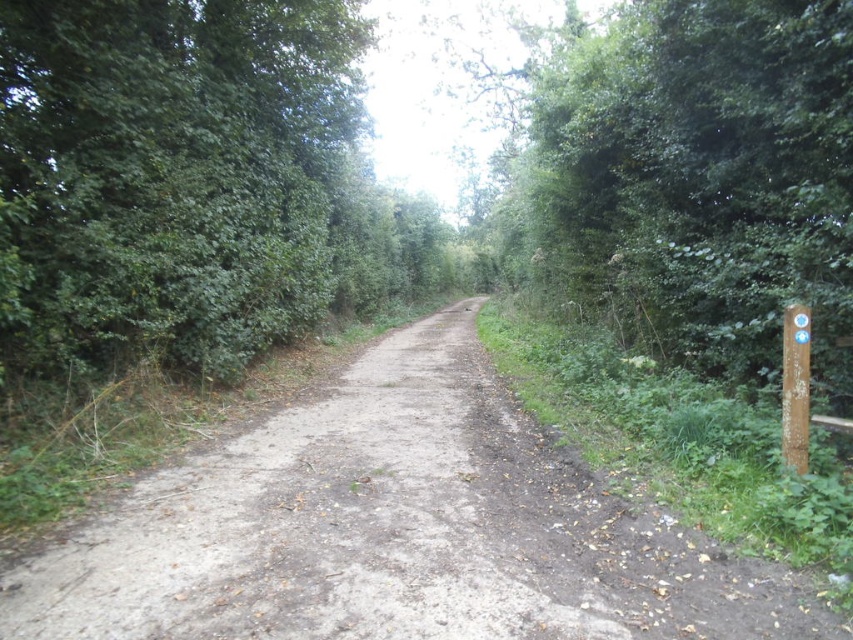
You are standing at the wooden post with two signs on the right side of the forest path. You need to walk to a specific location marked by either point 1 at coordinates point (595,611) or point 2 at coordinates point (93,44). Which point is closer to your current position?

Point (595,611) is closer to the viewer than point (93,44), so you should go to point (595,611) first.

You are standing at the wooden post with two signs on the right side of the forest path. You notice two points marked on the ground ahead of you. One is at point coordinates (427, 552) and the other at (770, 321). Which point is closer to you?

Point (427, 552) is closer to you than point (770, 321).

You are a hiker standing at the wooden post with two signs on the right side of the path. You want to move to the green leafy bush at left. Which direction should you walk to reach it?

The green leafy bush at left is located at point (170, 173), so you should walk to the left side of the path to reach it.